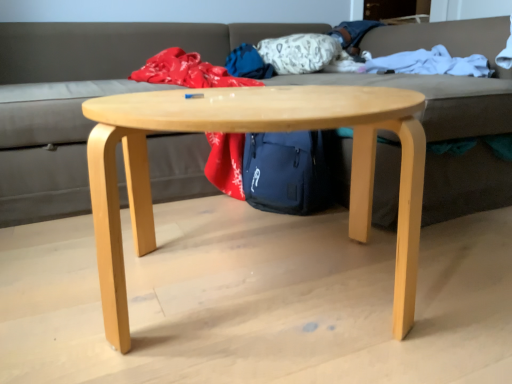
What do you see at coordinates (245, 132) in the screenshot?
I see `natural wood coffee table at center` at bounding box center [245, 132].

This screenshot has height=384, width=512. I want to click on gray fabric couch at center, so click(81, 99).

Which is more to the left, natural wood coffee table at center or white soft blanket at upper right?

natural wood coffee table at center is more to the left.

In terms of width, does natural wood coffee table at center look wider or thinner when compared to white soft blanket at upper right?

Clearly, natural wood coffee table at center has more width compared to white soft blanket at upper right.

Is natural wood coffee table at center next to white soft blanket at upper right?

natural wood coffee table at center and white soft blanket at upper right are clearly separated.

Would you say white soft blanket at upper right is part of natural wood coffee table at center's contents?

No, white soft blanket at upper right is not a part of natural wood coffee table at center.

Considering the sizes of objects gray fabric couch at center and natural wood coffee table at center in the image provided, who is shorter, gray fabric couch at center or natural wood coffee table at center?

Standing shorter between the two is natural wood coffee table at center.

From the image's perspective, is gray fabric couch at center under natural wood coffee table at center?

Incorrect, from the image's perspective, gray fabric couch at center is higher than natural wood coffee table at center.

What's the angular difference between gray fabric couch at center and natural wood coffee table at center's facing directions?

gray fabric couch at center and natural wood coffee table at center are facing 0.229 degrees away from each other.

Looking at this image, from a real-world perspective, which object rests below the other?

In real-world perspective, natural wood coffee table at center is lower.

Looking at the image, does natural wood coffee table at center seem bigger or smaller compared to gray fabric couch at center?

natural wood coffee table at center is smaller than gray fabric couch at center.

Is natural wood coffee table at center positioned with its back to gray fabric couch at center?

Yes.

Between natural wood coffee table at center and gray fabric couch at center, which one appears on the left side from the viewer's perspective?

Positioned to the left is natural wood coffee table at center.

Is point (124, 282) positioned after point (4, 95)?

No, it is not.

Is white soft blanket at upper right inside the boundaries of gray fabric couch at center, or outside?

white soft blanket at upper right can be found inside gray fabric couch at center.

Is white soft blanket at upper right facing away from gray fabric couch at center?

Yes, white soft blanket at upper right's orientation is away from gray fabric couch at center.

Is point (418, 54) positioned before point (448, 158)?

No, (418, 54) is further to viewer.

In the scene shown: From a real-world perspective, which object rests below the other?

gray fabric couch at center.

Is white soft blanket at upper right inside gray fabric couch at center?

Yes, gray fabric couch at center contains white soft blanket at upper right.

In the image, there is a gray fabric couch at center. At what (x,y) coordinates should I click in order to perform the action: click on blanket above it (from the image's perspective). Please return your answer as a coordinate pair (x, y). Looking at the image, I should click on (426, 63).

From the image's perspective, is gray fabric couch at center positioned above or below white soft blanket at upper right?

From the image's perspective, gray fabric couch at center appears below white soft blanket at upper right.

Considering the sizes of objects gray fabric couch at center and white soft blanket at upper right in the image provided, who is bigger, gray fabric couch at center or white soft blanket at upper right?

gray fabric couch at center is bigger.

Which is nearer, (392, 66) or (395, 127)?

Point (392, 66) is positioned farther from the camera compared to point (395, 127).

Is white soft blanket at upper right further to camera compared to natural wood coffee table at center?

Yes, the depth of white soft blanket at upper right is greater than that of natural wood coffee table at center.

In the scene shown: From the image's perspective, does white soft blanket at upper right appear lower than natural wood coffee table at center?

No, from the image's perspective, white soft blanket at upper right is not below natural wood coffee table at center.

Considering the sizes of objects white soft blanket at upper right and natural wood coffee table at center in the image provided, who is smaller, white soft blanket at upper right or natural wood coffee table at center?

Smaller between the two is white soft blanket at upper right.

Identify the location of blanket behind the natural wood coffee table at center. (426, 63).

Identify the location of studio couch to the right of natural wood coffee table at center. (81, 99).

From the image, which object appears to be farther from gray fabric couch at center, natural wood coffee table at center or white soft blanket at upper right?

natural wood coffee table at center is positioned further to the anchor gray fabric couch at center.

Which object lies further to the anchor point white soft blanket at upper right, natural wood coffee table at center or gray fabric couch at center?

Among the two, gray fabric couch at center is located further to white soft blanket at upper right.

Considering their positions, is gray fabric couch at center positioned further to white soft blanket at upper right than natural wood coffee table at center?

Based on the image, gray fabric couch at center appears to be further to white soft blanket at upper right.

Based on their spatial positions, is white soft blanket at upper right or natural wood coffee table at center closer to gray fabric couch at center?

white soft blanket at upper right.

When comparing their distances from natural wood coffee table at center, does gray fabric couch at center or white soft blanket at upper right seem further?

Based on the image, gray fabric couch at center appears to be further to natural wood coffee table at center.

From the image, which object appears to be nearer to natural wood coffee table at center, white soft blanket at upper right or gray fabric couch at center?

The object closer to natural wood coffee table at center is white soft blanket at upper right.

I want to click on studio couch positioned between natural wood coffee table at center and white soft blanket at upper right from near to far, so click(81, 99).